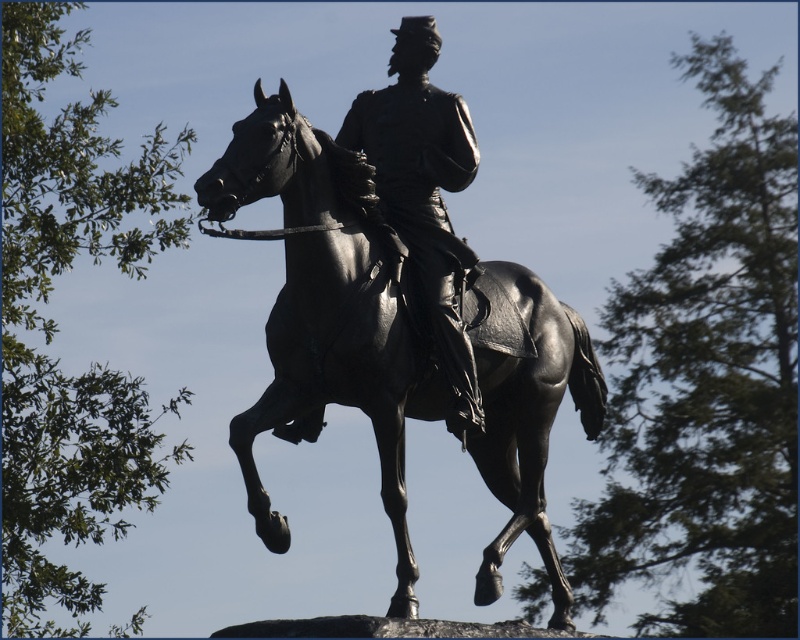
Is polished bronze horse at center positioned at the back of polished bronze statue at center?

No, polished bronze horse at center is closer to the viewer.

What are the coordinates of `polished bronze horse at center` in the screenshot? It's located at (324, 312).

Which is in front, point (285, 410) or point (377, 104)?

Point (285, 410) is in front.

Find the location of a particular element. The image size is (800, 640). polished bronze horse at center is located at coordinates (324, 312).